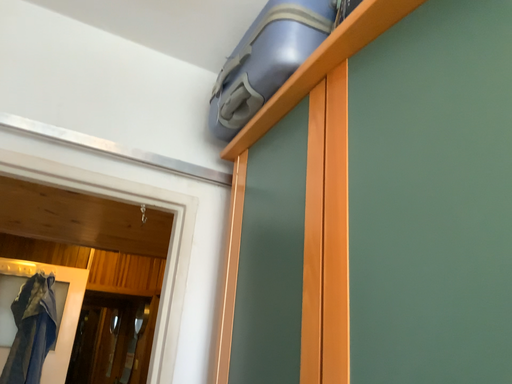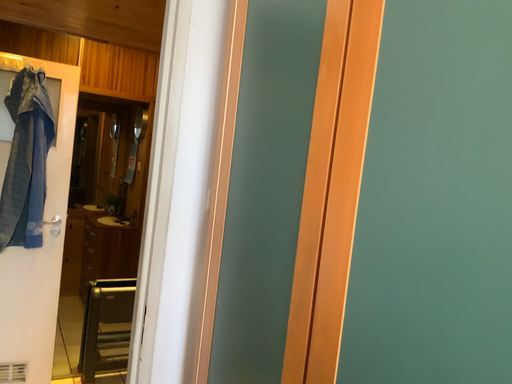
Question: How did the camera likely rotate when shooting the video?

Choices:
 (A) rotated upward
 (B) rotated downward

Answer: (B)